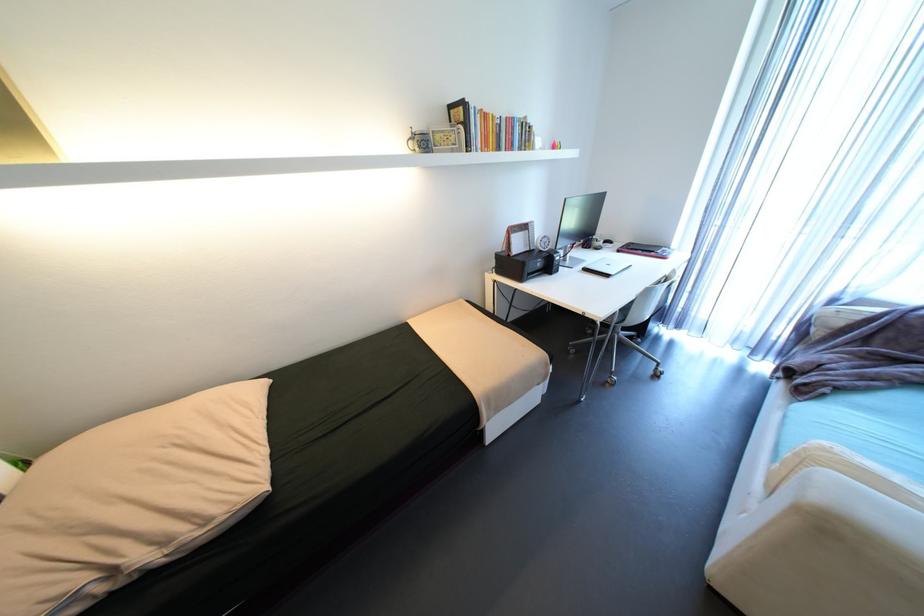
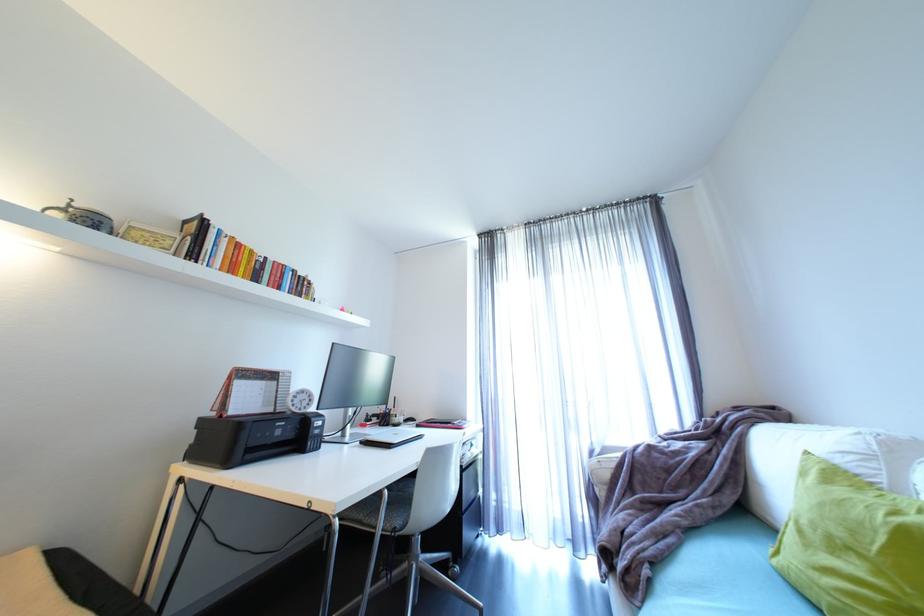
Find the pixel in the second image that matches point (833, 390) in the first image.

(653, 572)